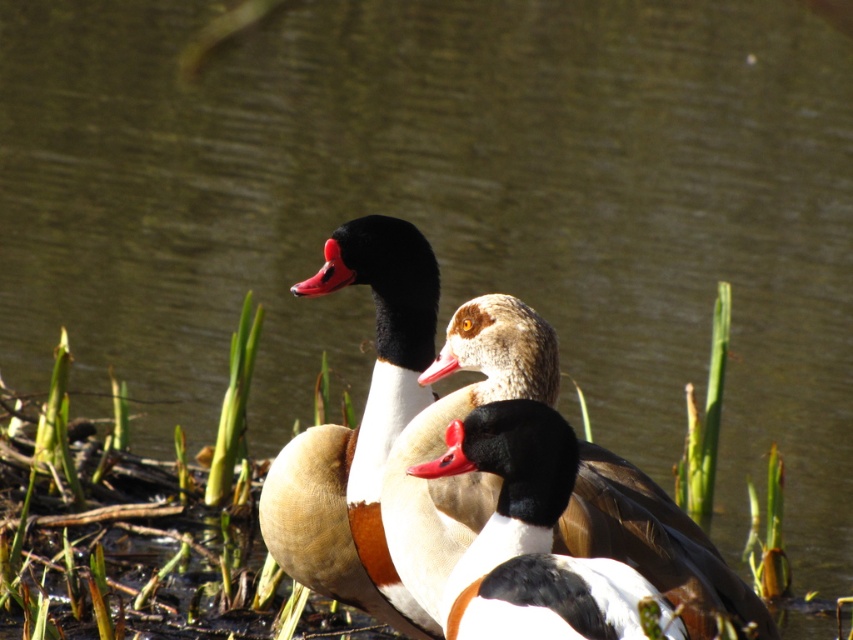
Question: Which point is farther to the camera?

Choices:
 (A) click(627, 620)
 (B) click(381, 314)

Answer: (B)

Question: Among these points, which one is nearest to the camera?

Choices:
 (A) (346, 259)
 (B) (541, 493)

Answer: (B)

Question: Which point is farther to the camera?

Choices:
 (A) (326, 515)
 (B) (526, 576)

Answer: (A)

Question: Is brown feathered duck at center smaller than white glossy duck at center?

Choices:
 (A) no
 (B) yes

Answer: (A)

Question: In this image, where is brown feathered duck at center located relative to white glossy duck at center?

Choices:
 (A) below
 (B) above

Answer: (B)

Question: Does brown feathered duck at center have a smaller size compared to white glossy duck at center?

Choices:
 (A) yes
 (B) no

Answer: (B)